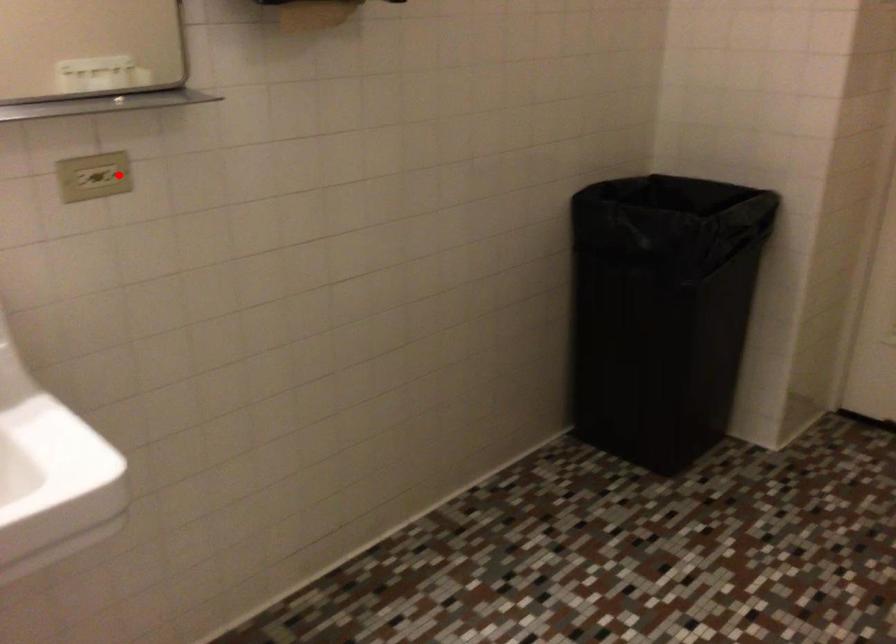
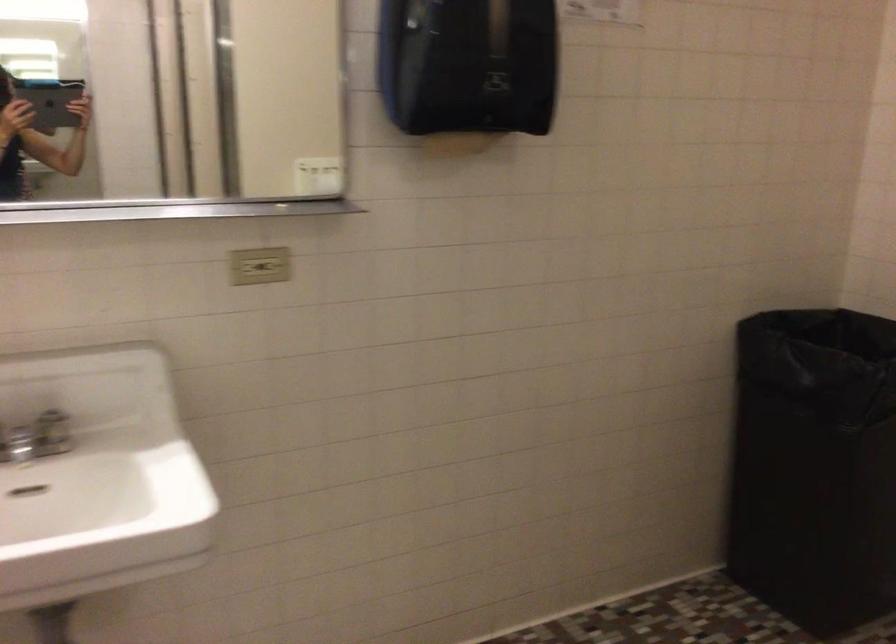
Question: I am providing you with two images of the same scene from different viewpoints. In image1, a red point is highlighted. Considering the same 3D point in image2, which of the following is correct?

Choices:
 (A) It is closer
 (B) It is farther

Answer: (B)